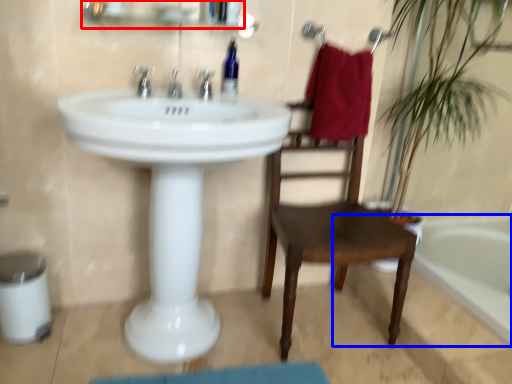
Question: Among these objects, which one is farthest to the camera, medicine cabinet (highlighted by a red box) or bathtub (highlighted by a blue box)?

Choices:
 (A) medicine cabinet
 (B) bathtub

Answer: (B)